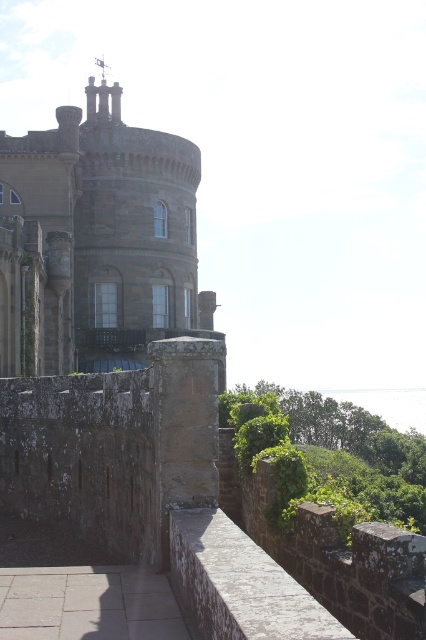
You are an architect assessing the structural integrity of the stone tower at center and the stone wall at center in this historic building. Which structure is taller?

The stone tower at center is taller than the stone wall at center.

You are an architect examining the historic stone building. You need to determine the spatial relationship between the stone tower at center and the stone wall at center. Which object is located to the left of the other?

The stone tower at center is positioned on the left side of stone wall at center.